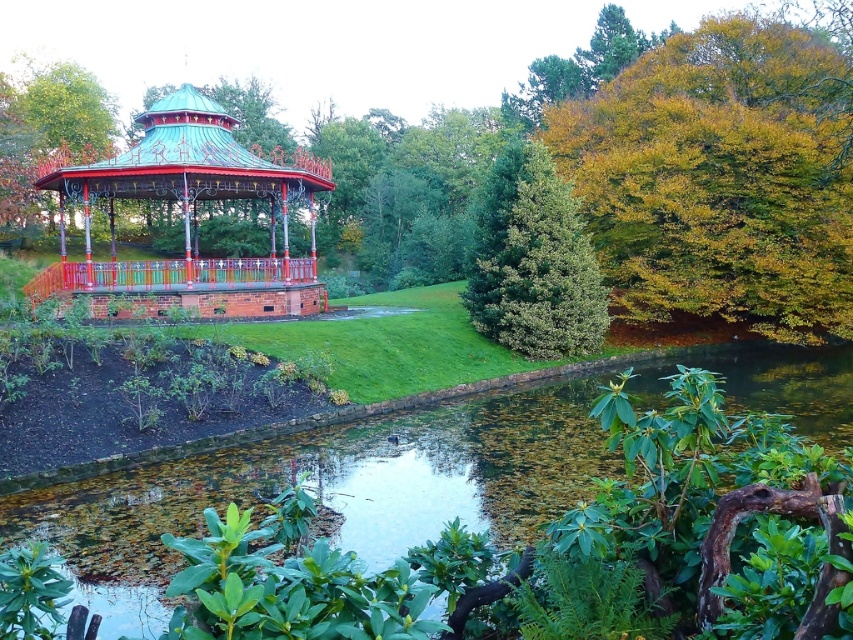
You are planning to place a new decorative statue in the scene. The statue requires a base that must be wider than the metallic copper gazebo at upper left but narrower than the green leafy water at center. Is there a suitable location between these two objects where you can place the statue?

The metallic copper gazebo at upper left has a lesser width compared to the green leafy water at center, so there is a suitable location between them where the statue can be placed as the required base width falls between their dimensions.

You are standing at the edge of the pond and want to walk towards the green textured tree at center and the green leafy water at center. Which one will you reach first?

The green leafy water at center is to the left of the green textured tree at center, so you will reach the green leafy water at center first.